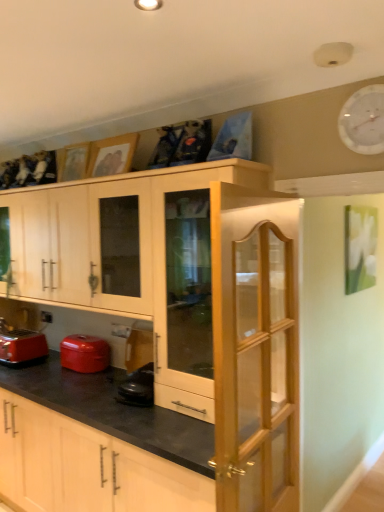
Locate an element on the screen. space that is in front of matte red toaster at lower left is located at coordinates (24, 373).